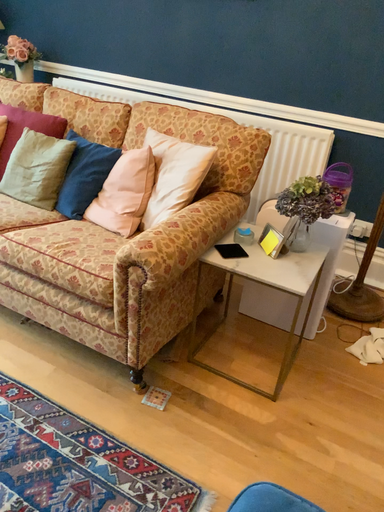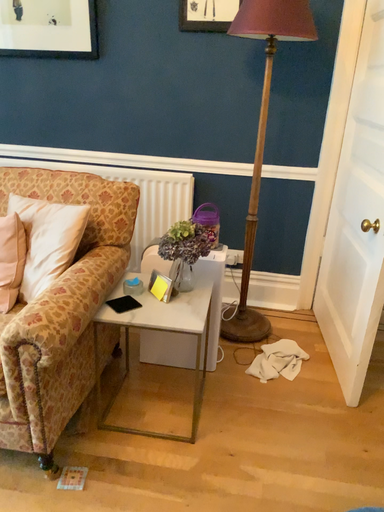
Question: Which way did the camera rotate in the video?

Choices:
 (A) rotated right
 (B) rotated left

Answer: (A)